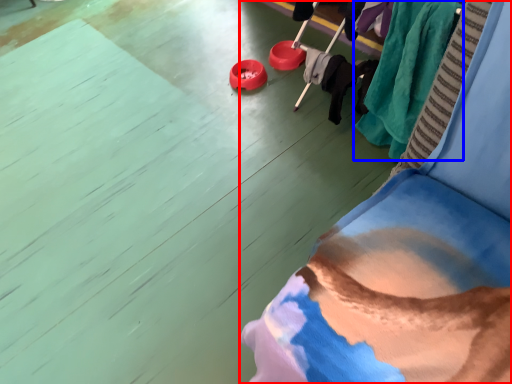
Question: Which point is further to the camera, furniture (highlighted by a red box) or clothing (highlighted by a blue box)?

Choices:
 (A) furniture
 (B) clothing

Answer: (B)